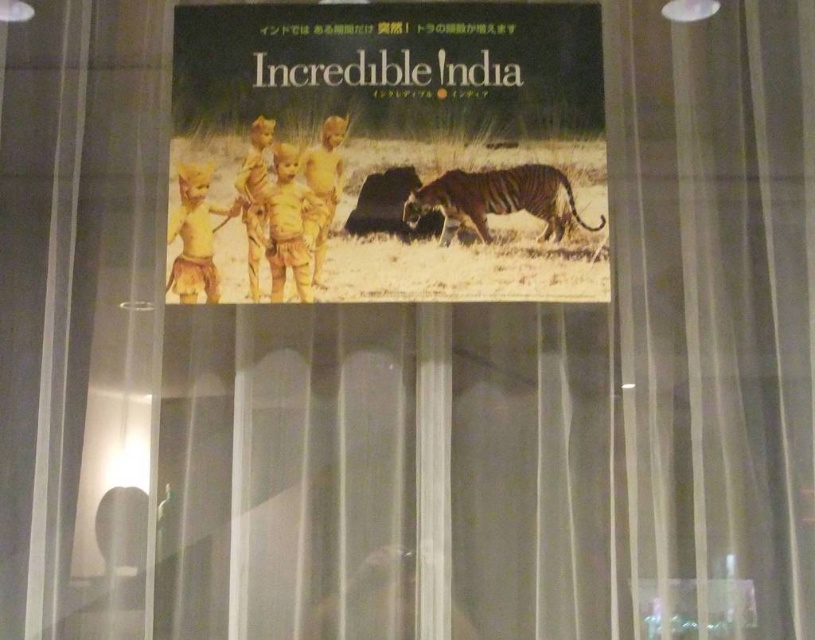
Question: Is matte yellow poster at center bigger than orange-brown fur tiger at center?

Choices:
 (A) no
 (B) yes

Answer: (B)

Question: Which point is farther from the camera taking this photo?

Choices:
 (A) (549, 173)
 (B) (175, 68)

Answer: (B)

Question: Does matte yellow poster at center have a lesser width compared to orange-brown fur tiger at center?

Choices:
 (A) yes
 (B) no

Answer: (B)

Question: Which point appears closest to the camera in this image?

Choices:
 (A) (567, 182)
 (B) (438, 49)

Answer: (A)

Question: Does matte yellow poster at center appear over orange-brown fur tiger at center?

Choices:
 (A) no
 (B) yes

Answer: (B)